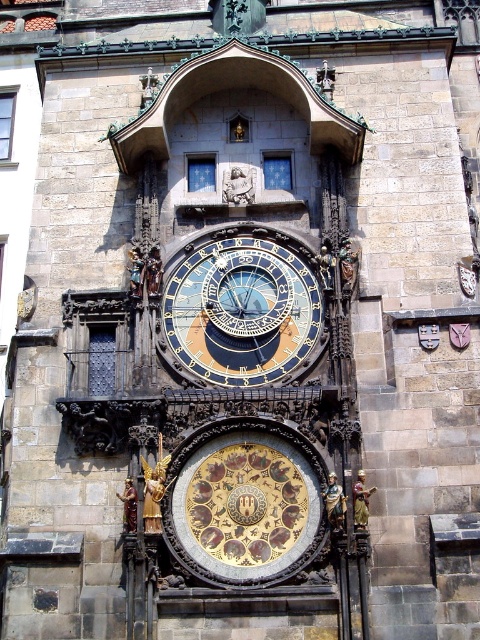
Question: Does gold/gilded/astrological clock at center have a smaller size compared to gold metallic clock at center?

Choices:
 (A) no
 (B) yes

Answer: (B)

Question: Among these objects, which one is nearest to the camera?

Choices:
 (A) gold metallic clock at center
 (B) gold/gilded/astrological clock at center

Answer: (B)

Question: Can you confirm if gold/gilded/astrological clock at center is smaller than gold metallic clock at center?

Choices:
 (A) yes
 (B) no

Answer: (A)

Question: Which point is closer to the camera?

Choices:
 (A) (240, 538)
 (B) (264, 243)

Answer: (A)

Question: Is gold/gilded/astrological clock at center smaller than gold metallic clock at center?

Choices:
 (A) no
 (B) yes

Answer: (B)